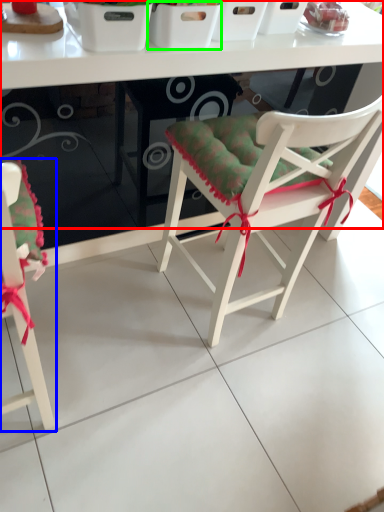
Question: Considering the real-world distances, which object is closest to table (highlighted by a red box)? chair (highlighted by a blue box) or basket (highlighted by a green box).

Choices:
 (A) chair
 (B) basket

Answer: (B)